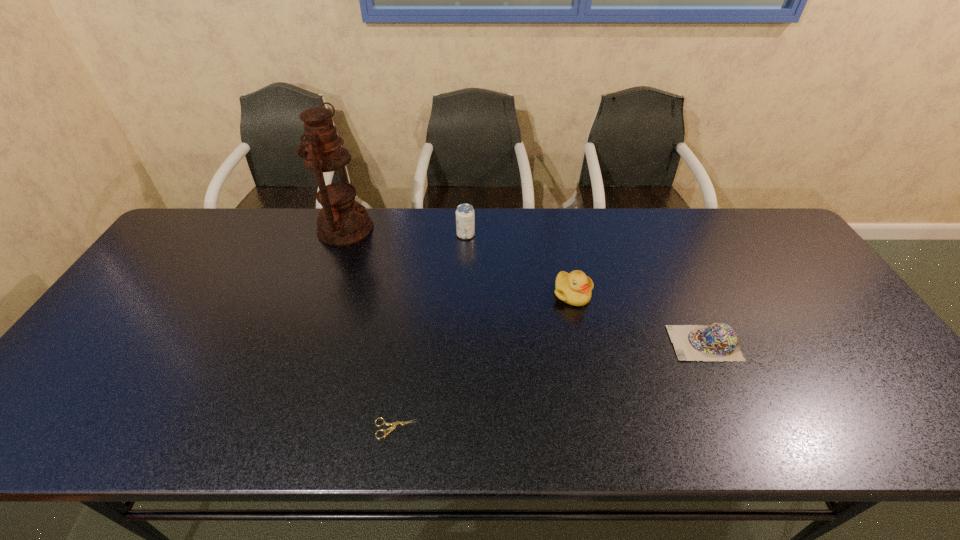
Where is `the tallest object`? Image resolution: width=960 pixels, height=540 pixels. the tallest object is located at coordinates (342, 221).

You are a GUI agent. You are given a task and a screenshot of the screen. Output one action in this format:
    pyautogui.click(x=<x>, y=<y>)
    Task: Click on the oil lamp
    The image size is (960, 540).
    Given the screenshot: What is the action you would take?
    pyautogui.click(x=342, y=221)

Locate an element on the screen. The image size is (960, 540). the third object from left to right is located at coordinates (465, 215).

Where is `the fourth object from left to right`? The height and width of the screenshot is (540, 960). the fourth object from left to right is located at coordinates (574, 288).

Where is `the third farthest object`? The image size is (960, 540). the third farthest object is located at coordinates (574, 288).

Locate an element on the screen. The image size is (960, 540). the fourth tallest object is located at coordinates (718, 341).

Find the location of a particular element. The image size is (960, 540). the rightmost object is located at coordinates (718, 341).

Where is `the shortest object`? The image size is (960, 540). the shortest object is located at coordinates (394, 424).

Locate an element on the screen. the nearest object is located at coordinates (394, 424).

Image resolution: width=960 pixels, height=540 pixels. I want to click on vacant region located on the left of the tallest object, so click(x=211, y=229).